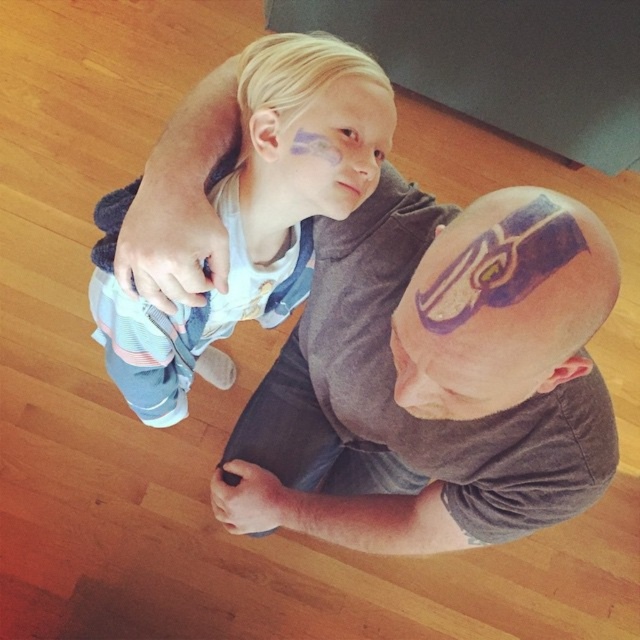
You are a photographer trying to capture a closeup shot of the purple matte bald head at center and the purple matte helmet at center. Which object should you focus on first to ensure both are in focus?

You should focus on the purple matte bald head at center first because it is closer to you than the purple matte helmet at center, so adjusting focus from near to far will help both be in focus.

You are a photographer trying to capture a closeup shot of the purple matte bald head at center and the purple matte helmet at center. Which one should you focus on first if you want to ensure both are in focus without adjusting the camera settings?

The purple matte bald head at center is located below the purple matte helmet at center. Since the bald head is closer to the camera, focusing on it first will naturally bring the helmet into focus as well due to the overlapping depth of field.